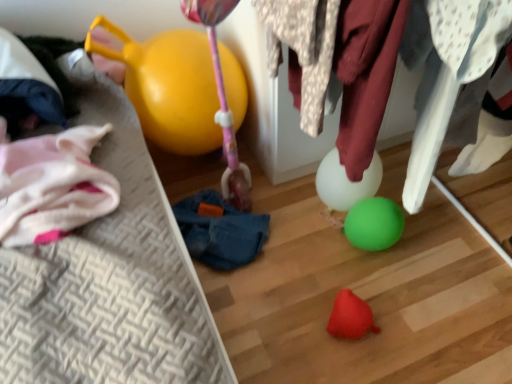
Identify the location of vacant area to the right of rubber red toy at lower center. The height and width of the screenshot is (384, 512). (414, 320).